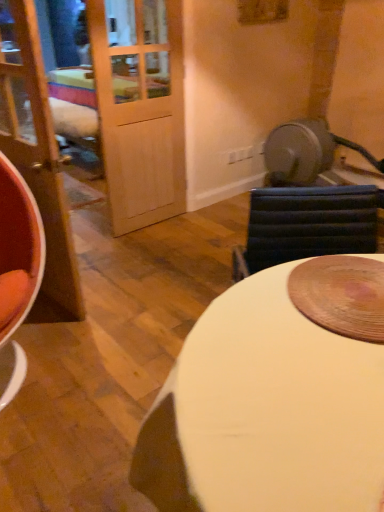
Where is `white glossy table at center`? white glossy table at center is located at coordinates coord(265,412).

This screenshot has height=512, width=384. What do you see at coordinates (265, 412) in the screenshot? I see `white glossy table at center` at bounding box center [265, 412].

What is the approximate height of matte wood door at left?

1.44 meters.

Consider the image. In order to face matte wood door at left, should I rotate leftwards or rightwards?

Turn left approximately 20.899 degrees to face it.

Describe the element at coordinates (40, 161) in the screenshot. The height and width of the screenshot is (512, 384). I see `matte wood door at left` at that location.

Measure the distance between point (22, 34) and camera.

They are 1.57 meters apart.

The width and height of the screenshot is (384, 512). I want to click on matte wood door at left, so click(40, 161).

I want to click on white glossy table at center, so click(265, 412).

Is white glossy table at center at the right side of matte wood door at left?

Indeed, white glossy table at center is positioned on the right side of matte wood door at left.

Which object is further away from the camera, white glossy table at center or matte wood door at left?

matte wood door at left is behind.

Does point (366, 421) come closer to viewer compared to point (3, 96)?

Yes.

Consider the image. From the image's perspective, relative to matte wood door at left, is white glossy table at center above or below?

white glossy table at center is situated lower than matte wood door at left in the image.

From a real-world perspective, is white glossy table at center on matte wood door at left?

Incorrect, from a real-world perspective, white glossy table at center is lower than matte wood door at left.

Is white glossy table at center thinner than matte wood door at left?

Incorrect, the width of white glossy table at center is not less than that of matte wood door at left.

Does white glossy table at center have a greater height compared to matte wood door at left?

In fact, white glossy table at center may be shorter than matte wood door at left.

Can you confirm if white glossy table at center is smaller than matte wood door at left?

Incorrect, white glossy table at center is not smaller in size than matte wood door at left.

Is white glossy table at center not inside matte wood door at left?

Yes, white glossy table at center is located beyond the bounds of matte wood door at left.

Consider the image. Would you say white glossy table at center is a long distance from matte wood door at left?

That's right, there is a large distance between white glossy table at center and matte wood door at left.

Is matte wood door at left at the back of white glossy table at center?

white glossy table at center is not turned away from matte wood door at left.

How many degrees apart are the facing directions of white glossy table at center and matte wood door at left?

The angular difference between white glossy table at center and matte wood door at left is 0.984 degrees.

Measure the distance between white glossy table at center and matte wood door at left.

white glossy table at center and matte wood door at left are 1.35 meters apart.

Locate an element on the screen. The image size is (384, 512). door that appears on the left of white glossy table at center is located at coordinates (40, 161).

Is matte wood door at left at the right side of white glossy table at center?

In fact, matte wood door at left is to the left of white glossy table at center.

Considering the relative positions of matte wood door at left and white glossy table at center in the image provided, is matte wood door at left behind white glossy table at center?

Yes, matte wood door at left is further from the viewer.

Does point (45, 182) appear closer or farther from the camera than point (282, 272)?

Point (45, 182) is farther from the camera than point (282, 272).

From the image's perspective, between matte wood door at left and white glossy table at center, which one is located above?

matte wood door at left appears higher in the image.

From a real-world perspective, does matte wood door at left sit lower than white glossy table at center?

Incorrect, from a real-world perspective, matte wood door at left is higher than white glossy table at center.

Which object is thinner, matte wood door at left or white glossy table at center?

matte wood door at left.

Considering the sizes of matte wood door at left and white glossy table at center in the image, is matte wood door at left taller or shorter than white glossy table at center?

matte wood door at left is taller than white glossy table at center.

In terms of size, does matte wood door at left appear bigger or smaller than white glossy table at center?

Clearly, matte wood door at left is smaller in size than white glossy table at center.

Is matte wood door at left surrounding white glossy table at center?

No, white glossy table at center is located outside of matte wood door at left.

Is matte wood door at left directly adjacent to white glossy table at center?

matte wood door at left and white glossy table at center are not in contact.

From the picture: Does matte wood door at left turn towards white glossy table at center?

No, matte wood door at left is not facing towards white glossy table at center.

What's the angular difference between matte wood door at left and white glossy table at center's facing directions?

0.984 degrees.

Measure the distance between matte wood door at left and white glossy table at center.

matte wood door at left is 1.35 meters from white glossy table at center.

Locate an element on the screen. The image size is (384, 512). door that is above the white glossy table at center (from a real-world perspective) is located at coordinates (40, 161).

Where is `table lying below the matte wood door at left (from the image's perspective)`? The width and height of the screenshot is (384, 512). table lying below the matte wood door at left (from the image's perspective) is located at coordinates (265, 412).

Image resolution: width=384 pixels, height=512 pixels. What are the coordinates of `door located behind the white glossy table at center` in the screenshot? It's located at (40, 161).